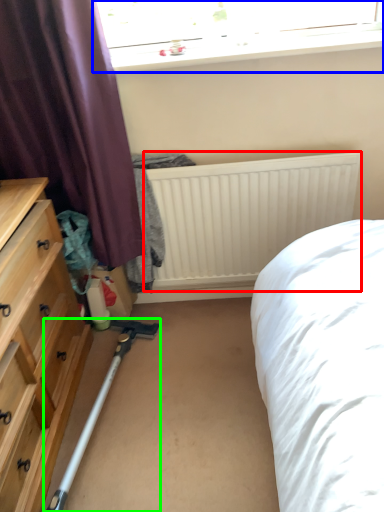
Question: Which object is the closest to the radiator (highlighted by a red box)? Choose among these: window (highlighted by a blue box) or equipment (highlighted by a green box).

Choices:
 (A) window
 (B) equipment

Answer: (A)